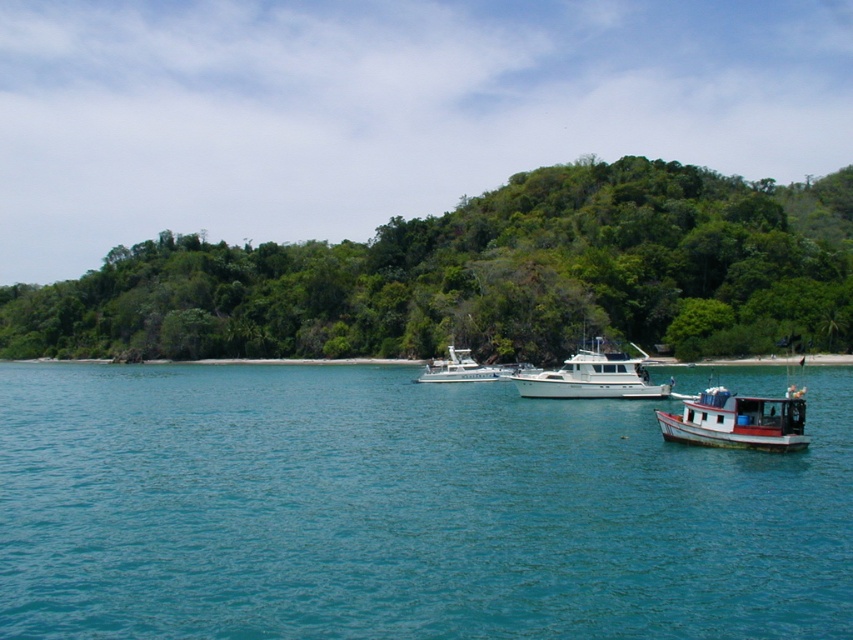
In the scene shown: You are a photographer planning to capture the entire scene of the clear blue water at center and the white glossy yacht at center in a single shot. Which object will occupy more horizontal space in the photo?

The clear blue water at center will occupy more horizontal space in the photo because its width surpasses that of the white glossy yacht at center.

You are standing at the point marked by the coordinates point (721, 417) in the coastal scene. You want to walk directly towards the viewer. How far will you have to walk to reach them?

The distance between point (721, 417) and the viewer is 22.56 meters, so you would need to walk 22.56 meters to reach them.

You are standing at the origin point in the image. Which direction should you move to reach the green leafy trees at center?

The green leafy trees at center are located at coordinates approximately 0.433 on the x axis and 0.569 on the y axis. Since you are at the origin point, you should move towards the right and upwards to reach them.